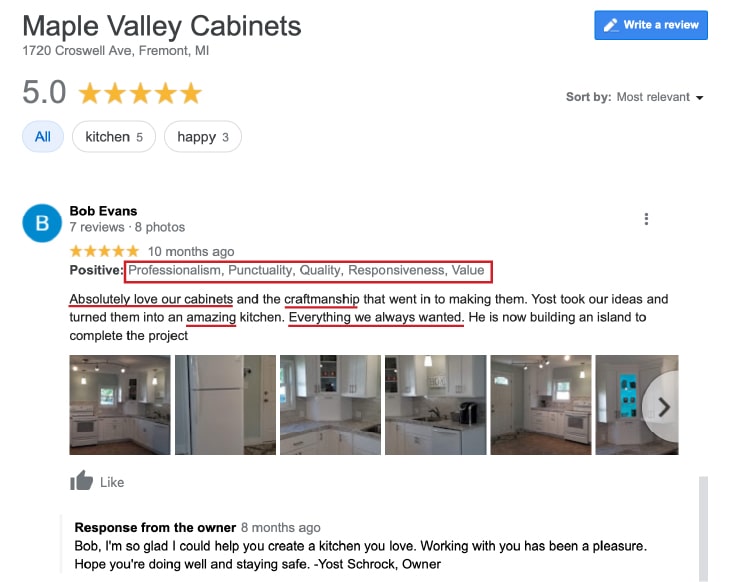
Locate an element on the screen. The width and height of the screenshot is (730, 582). refrigerator handles is located at coordinates (199, 401), (196, 375).